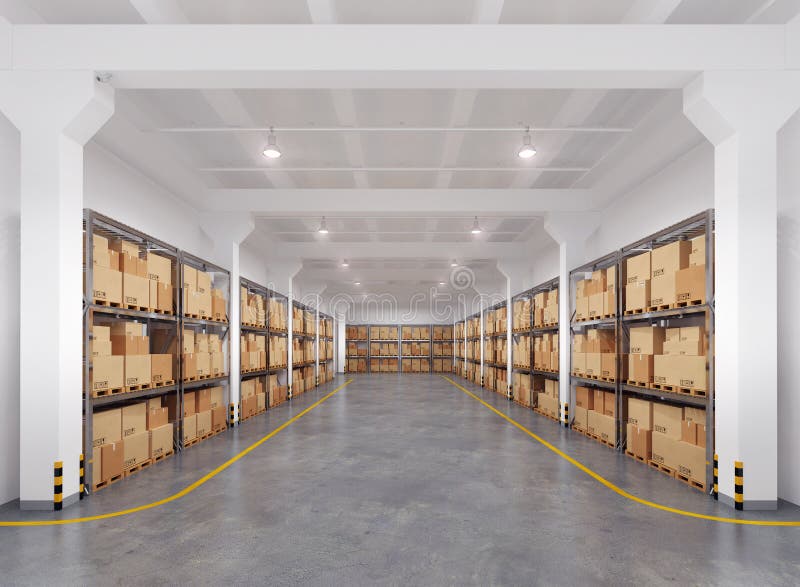
The image size is (800, 587). Identify the location of lights. (277, 149), (320, 227), (342, 261), (354, 281), (368, 298), (534, 150), (478, 230), (456, 263), (442, 284).